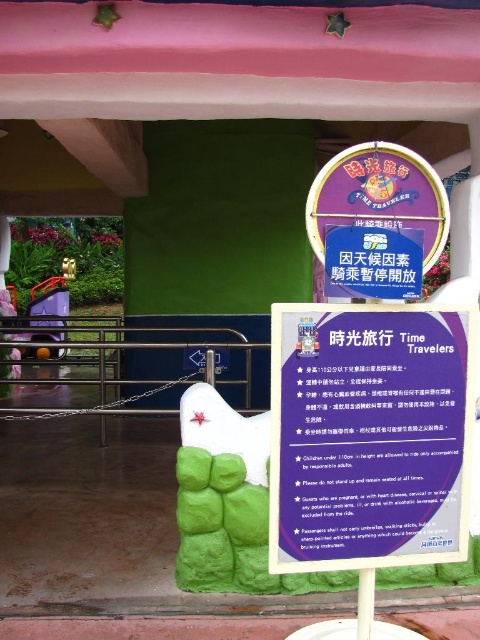
You are standing at the point marked as point (360, 465) and want to take a photo of the signboard. The camera you are using has a focal length of 50mm and a sensor size of 24mm x 36mm. What is the minimum distance you need to move towards the signboard to ensure the entire signboard fits within the camera frame?

The point (360, 465) and viewer are 2.35 meters apart. To calculate the minimum distance required, first determine the field of view of the camera. The diagonal field of view for a 50mm lens on a 24x36mm sensor is approximately 46 degrees. Using trigonometry, the distance needed to fit the signboard within the frame can be calculated. However, without knowing the dimensions of the signboard, an exact distance cannot be determined. Therefore, the question cannot be answered with the provided information.

You are a visitor at the park and want to read the instructions on the purple paper sign at center and the purple glossy sign at center. Which one can you read more clearly from where you are standing?

The purple paper sign at center is closer to the viewer than the purple glossy sign at center, so you can read the purple paper sign at center more clearly.

You are a park visitor who wants to read the instructions for the Time Travelers ride. Where exactly is the purple paper sign at center located in terms of coordinates?

The purple paper sign at center is located at coordinates point (370, 435).